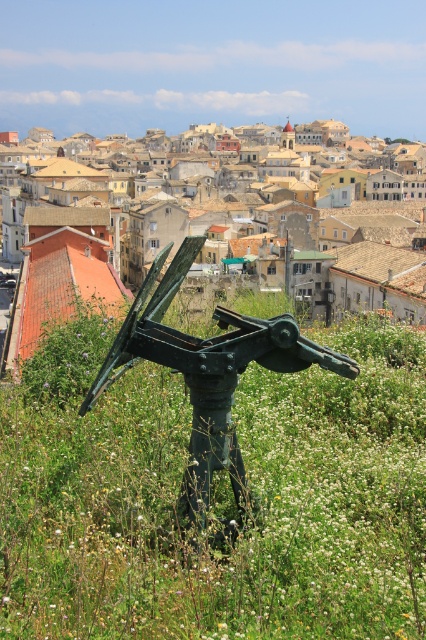
This screenshot has height=640, width=426. In order to click on green grassy at center in this screenshot , I will do click(215, 497).

Is green grassy at center bigger than green metal sculpture at center?

No.

Identify the location of green grassy at center. (215, 497).

Identify the location of green grassy at center. (215, 497).